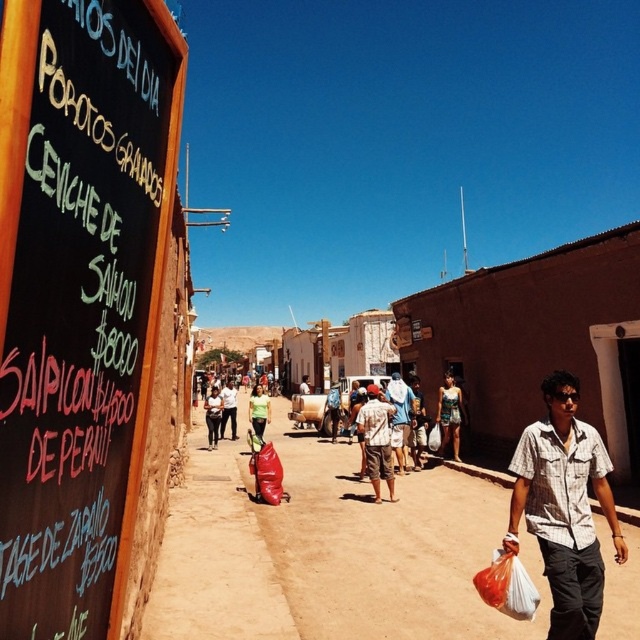
Looking at this image, you are standing at the origin point in the scene. Which object is located at the coordinates point (564,508)?

The plaid cotton shirt at lower right is located at point (564,508).

You are a photographer standing at the point with coordinates (378, 440) in the image. What is the closest object to you in the scene?

The closest object to you at point (378, 440) is the light brown fabric shirt at center.